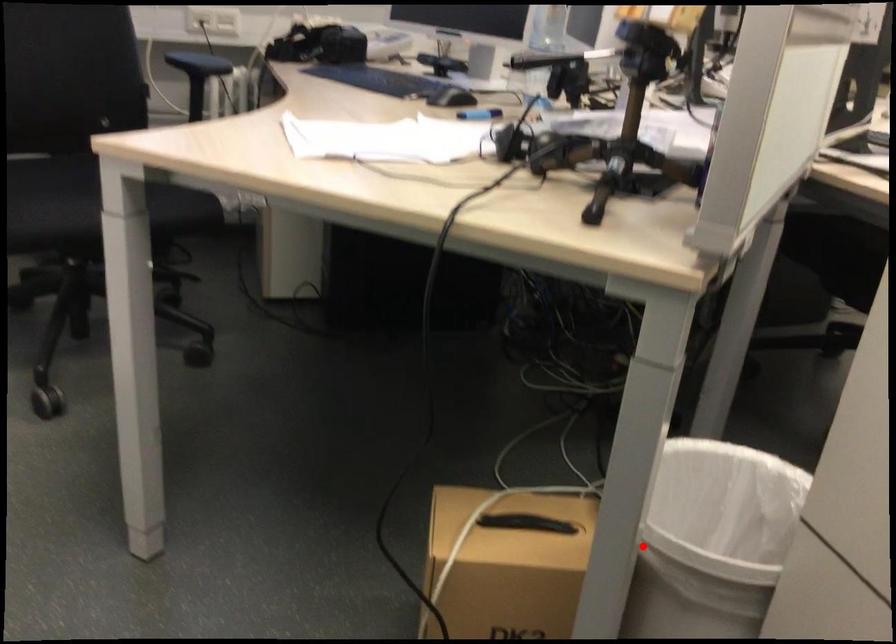
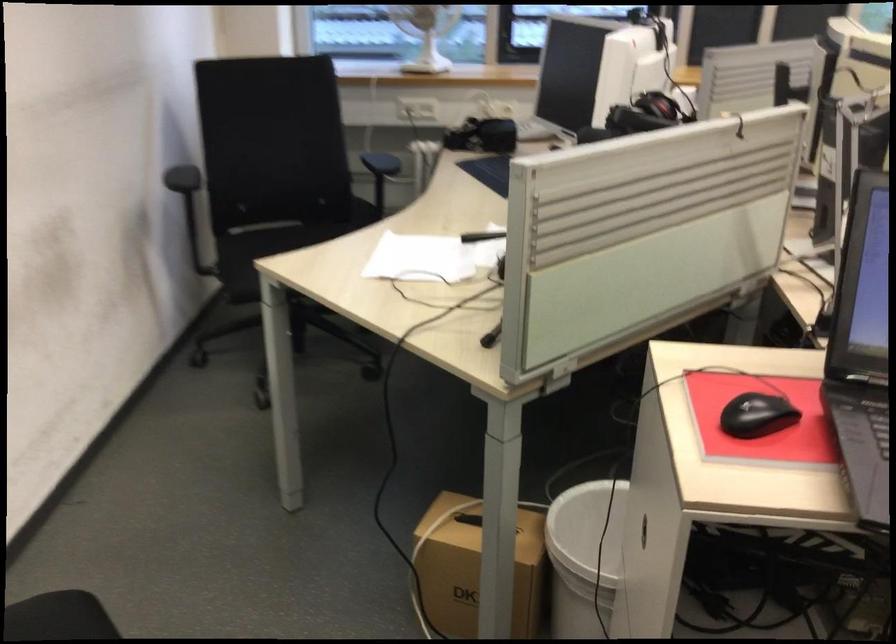
Find the pixel in the second image that matches the highlighted location in the first image.

(584, 556)